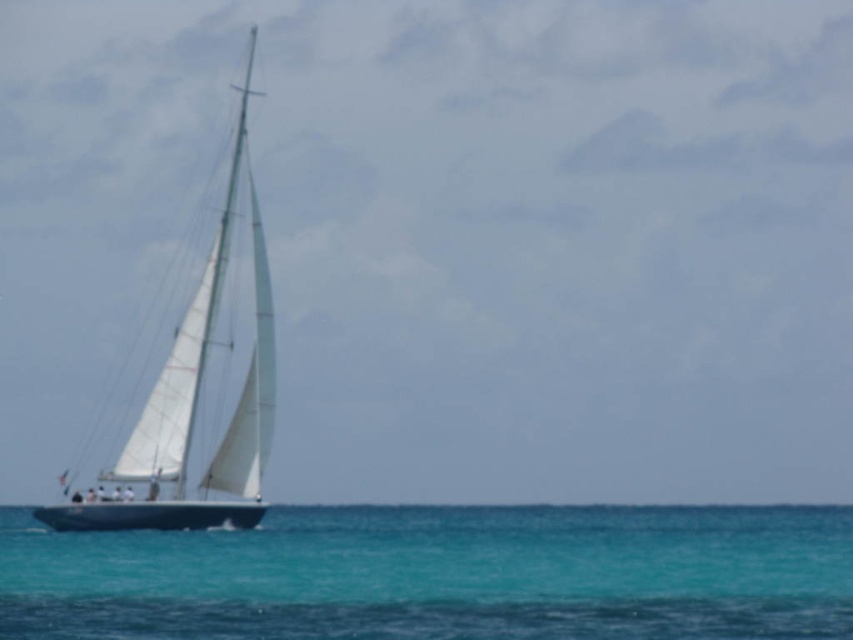
You are standing on a pier and see the clear blue water at center and the white matte sailboat at left. Which object is closer to the horizon?

The white matte sailboat at left is closer to the horizon than the clear blue water at center because the water is located below the sailboat.

You are a sailor on a boat and you need to navigate through the clear blue water at center and the white matte sailboat at left. Which object is closer to the horizon?

The clear blue water at center is shorter than the white matte sailboat at left, so the sailboat is closer to the horizon.